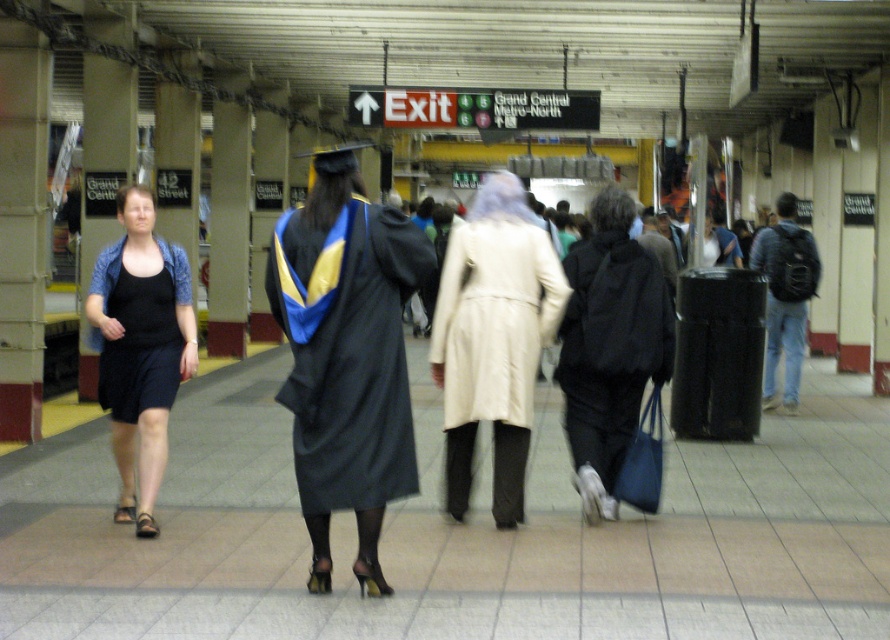
You are standing at the entrance of the subway station and see a beige fabric coat at center. Where is the beige fabric coat at center located relative to the point marked at coordinates (492,339)?

The beige fabric coat at center is located exactly at the point marked at coordinates (492,339).

You are a photographer trying to capture both the matte black gown at center and the black matte dress at center in the same frame. Since they are both positioned at the center of the scene, which one is closer to you so that you can adjust your focus accordingly?

The matte black gown at center is closer to you because it is in front of the black matte dress at center, so you should focus on the matte black gown at center first.

Based on the photo, you are a photographer at Grand Central Terminal trying to capture a candid shot of two people wearing the beige fabric coat at center and the black matte dress at center. Since you want to ensure both are fully visible in the frame, which clothing item should you focus on to avoid cropping the bottom of either outfit?

The beige fabric coat at center is shorter than the black matte dress at center. To ensure both are fully visible, focus on the black matte dress at center since it is longer, and the shorter beige fabric coat at center will naturally be within the frame as well.